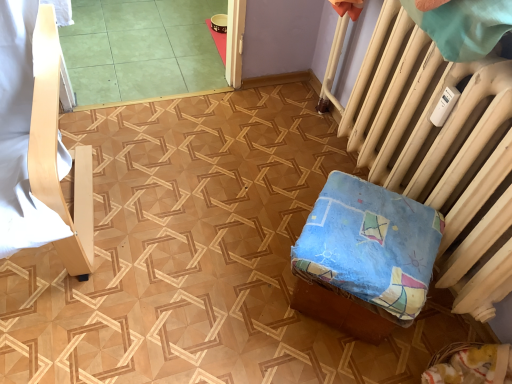
What are the coordinates of `free point to the right of light wood chair at left, which is the second furniture from right to left` in the screenshot? It's located at (200, 226).